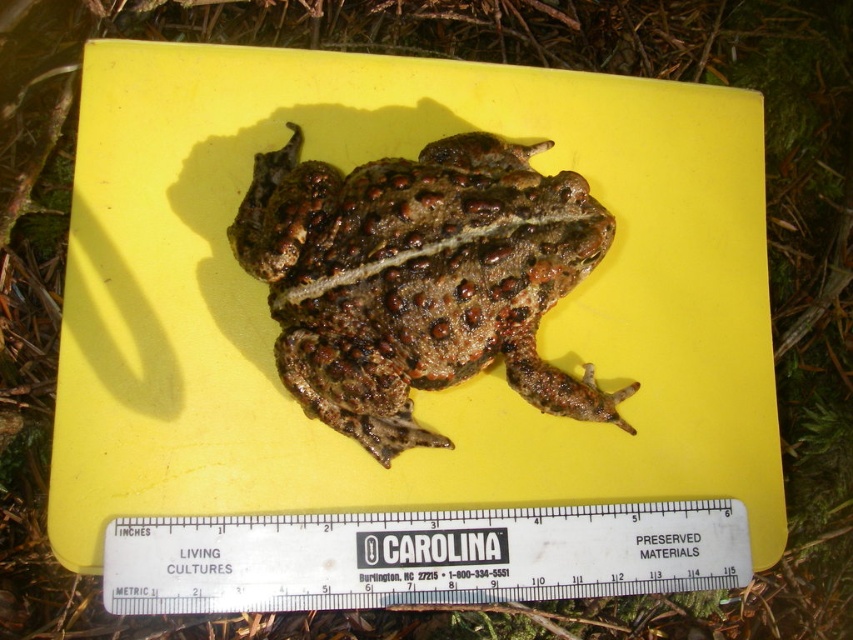
Question: Does spotted brown skin at center appear on the left side of white plastic ruler at center?

Choices:
 (A) no
 (B) yes

Answer: (A)

Question: Which of the following is the farthest from the observer?

Choices:
 (A) white plastic ruler at center
 (B) spotted brown skin at center

Answer: (B)

Question: Is spotted brown skin at center further to the viewer compared to white plastic ruler at center?

Choices:
 (A) no
 (B) yes

Answer: (B)

Question: Is spotted brown skin at center bigger than white plastic ruler at center?

Choices:
 (A) yes
 (B) no

Answer: (A)